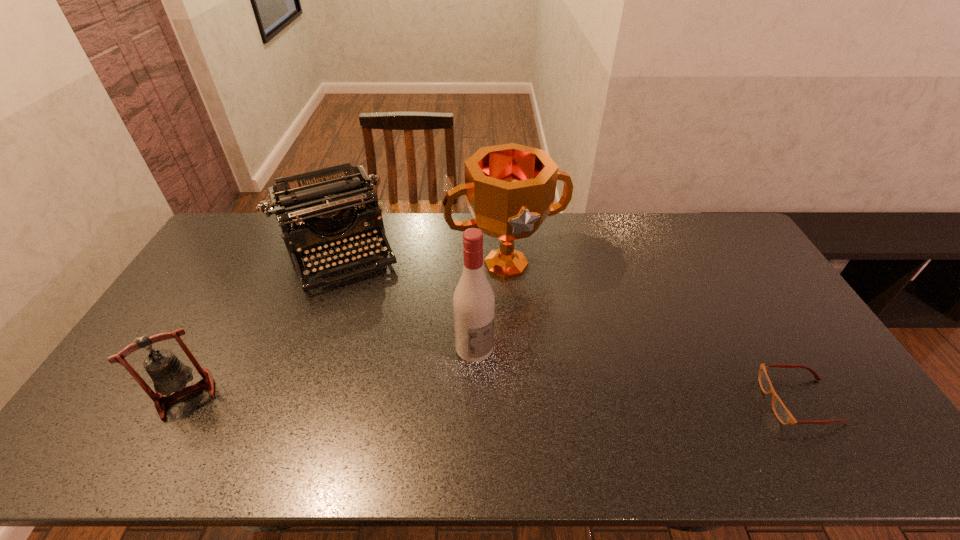
Locate an element on the screen. the fourth closest object to the rightmost object is located at coordinates (168, 373).